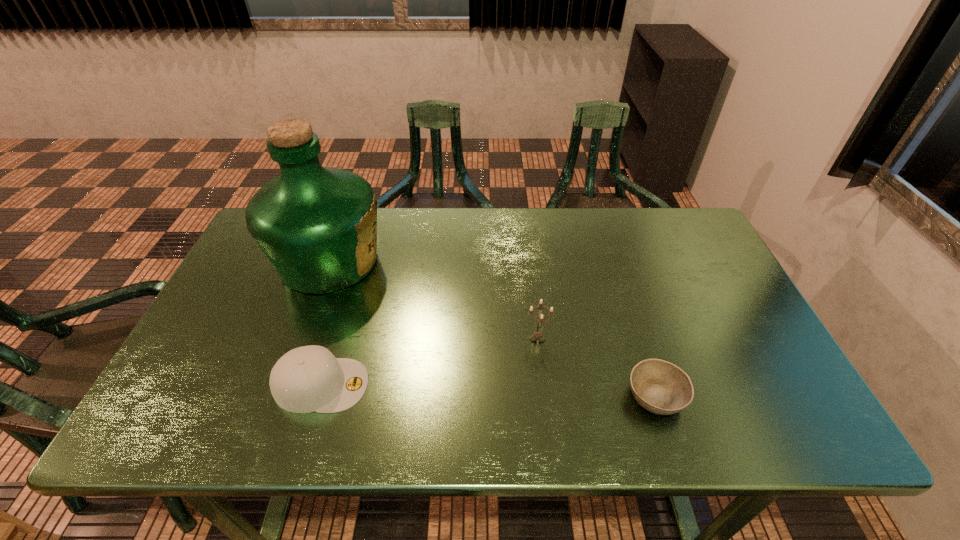
The width and height of the screenshot is (960, 540). Identify the location of free space at the near left corner of the desktop. (156, 426).

In the image, there is a desktop. Identify the location of vacant space at the far right corner. The image size is (960, 540). (681, 233).

Where is `vacant area at the near right corner`? This screenshot has height=540, width=960. vacant area at the near right corner is located at coordinates (745, 426).

Locate an element on the screen. The height and width of the screenshot is (540, 960). free space between the third tallest object and the candle holder is located at coordinates (429, 362).

Where is `vacant region between the second shortest object and the tallest object`? This screenshot has width=960, height=540. vacant region between the second shortest object and the tallest object is located at coordinates (325, 323).

In order to click on vacant space that's between the candle holder and the tallest object in this screenshot , I will do `click(433, 300)`.

I want to click on free space between the bowl and the cap, so click(489, 390).

Where is `free point between the bowl and the third tallest object`? This screenshot has height=540, width=960. free point between the bowl and the third tallest object is located at coordinates (489, 390).

You are a GUI agent. You are given a task and a screenshot of the screen. Output one action in this format:
    pyautogui.click(x=<x>, y=<y>)
    Task: Click on the vacant area that lies between the second object from right to left and the third tallest object
    The width and height of the screenshot is (960, 540).
    Given the screenshot: What is the action you would take?
    pyautogui.click(x=429, y=362)

Find the location of a particular element. free space between the second farthest object and the shortest object is located at coordinates (596, 368).